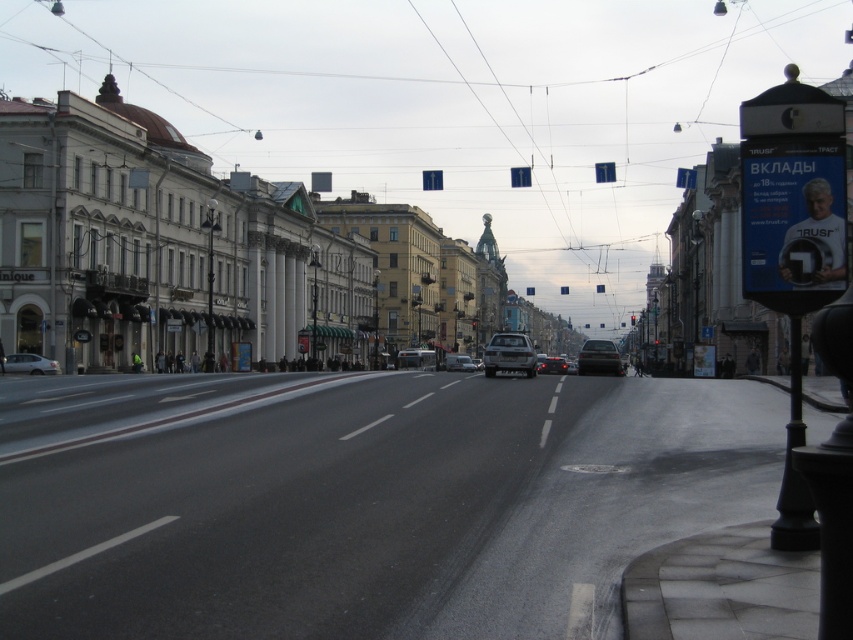
You are a delivery person trying to park your 1.8 meters tall delivery box in the space between the metallic silver car at center and the shiny black sedan at center. Can you fit your delivery box vertically between them?

The metallic silver car at center is much taller than the shiny black sedan at center. Since the delivery box is 1.8 meters tall, it can be placed vertically between them as long as the shorter vehicle is at least 1.8 meters in height. However, without knowing the exact height of the shorter vehicle, we cannot confirm if it will fit. Please check the actual height of the shiny black sedan at center before placing the delivery box.

From the picture: You are a delivery person needing to park your motorcycle between the silver metallic car at left and the silver metallic suv at center. Can you fit your motorcycle, which is 1.2 meters wide, in the space between them?

The silver metallic car at left is thinner than the silver metallic suv at center. Since the motorcycle is 1.2 meters wide, the space between them may be sufficient if the distance between the two vehicles is at least 1.2 meters. However, without knowing the exact distance between them, it is uncertain whether the motorcycle will fit.